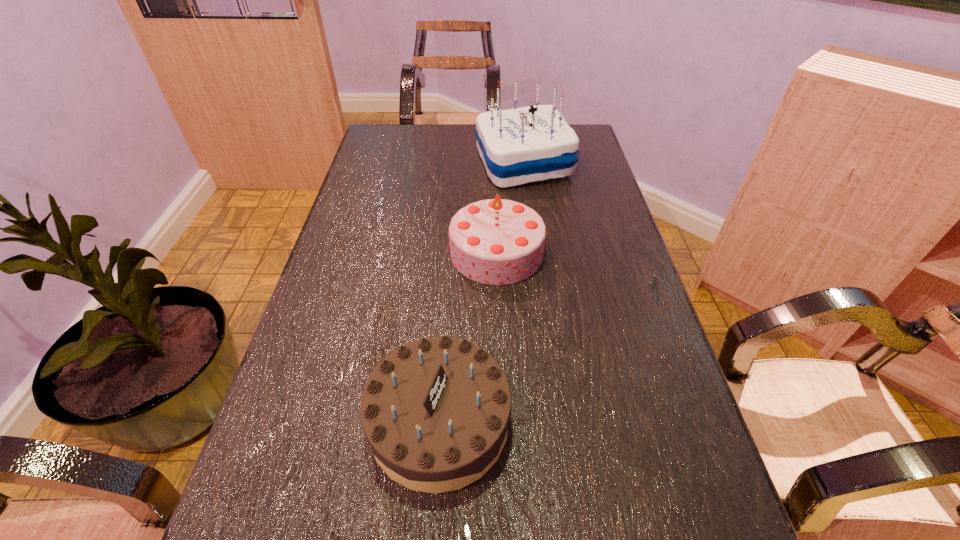
Identify the location of object that is at the right edge. The width and height of the screenshot is (960, 540). (517, 146).

At what (x,y) coordinates should I click in order to perform the action: click on object positioned at the far right corner. Please return your answer as a coordinate pair (x, y). Looking at the image, I should click on (517, 146).

This screenshot has height=540, width=960. I want to click on free region at the far edge, so click(x=476, y=147).

The height and width of the screenshot is (540, 960). What are the coordinates of `vacant region at the left edge of the desktop` in the screenshot? It's located at (375, 268).

The image size is (960, 540). I want to click on free space at the right edge of the desktop, so click(x=696, y=507).

Image resolution: width=960 pixels, height=540 pixels. Find the location of `vacant space at the far left corner of the desktop`. vacant space at the far left corner of the desktop is located at coordinates (372, 156).

At what (x,y) coordinates should I click in order to perform the action: click on free space between the second shortest birthday cake and the nearest object. Please return your answer as a coordinate pair (x, y). This screenshot has height=540, width=960. Looking at the image, I should click on (468, 337).

This screenshot has width=960, height=540. I want to click on free space between the shortest birthday cake and the second farthest object, so click(x=468, y=337).

Where is `vacant region between the second shortest birthday cake and the shortest object`? The width and height of the screenshot is (960, 540). vacant region between the second shortest birthday cake and the shortest object is located at coordinates (468, 337).

Select which object is the closest to the second tallest object. Please provide its 2D coordinates. Your answer should be formatted as a tuple, i.e. [(x, y)], where the tuple contains the x and y coordinates of a point satisfying the conditions above.

[(517, 146)]